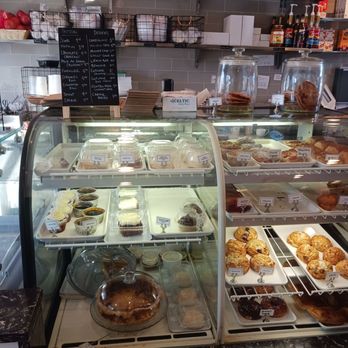
The width and height of the screenshot is (348, 348). I want to click on bottles, so click(289, 39), click(314, 30).